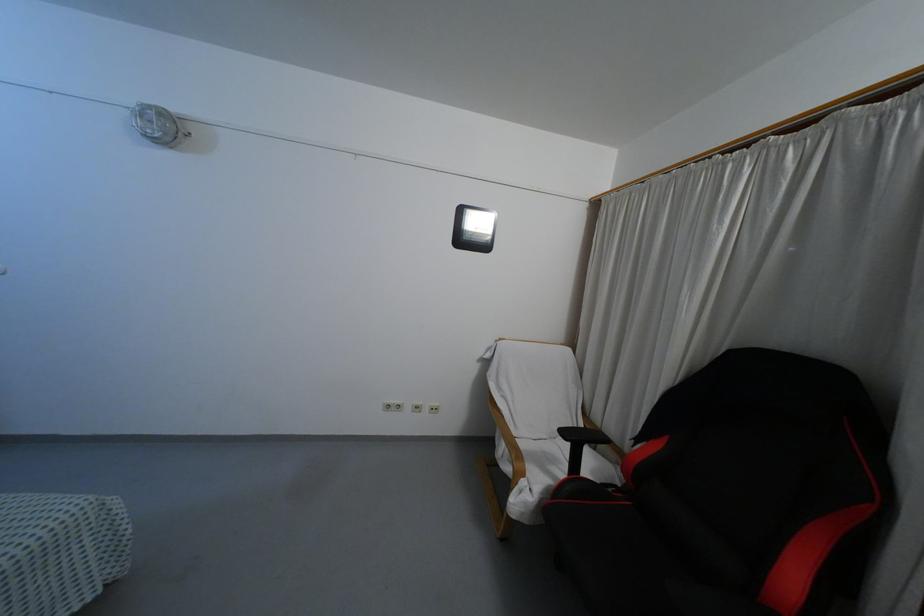
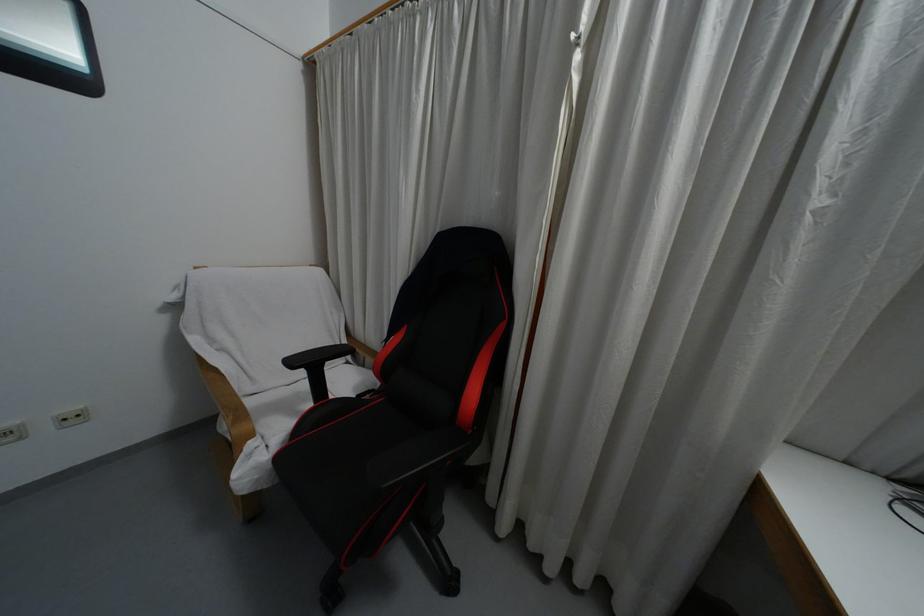
The point at [563,432] is marked in the first image. Where is the corresponding point in the second image?

(292, 362)